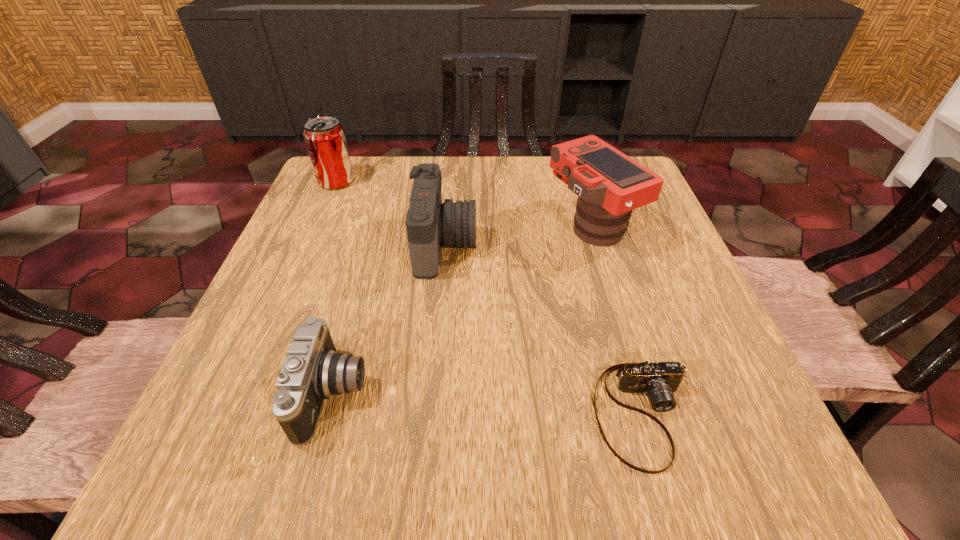
Identify which object is the third closest to the third object from left to right. Please provide its 2D coordinates. Your answer should be formatted as a tuple, i.e. [(x, y)], where the tuple contains the x and y coordinates of a point satisfying the conditions above.

[(325, 138)]

Find the location of a particular element. The height and width of the screenshot is (540, 960). the second closest camera to the third object from right to left is located at coordinates (312, 371).

Choose which camera is the second nearest neighbor to the third object from right to left. Please provide its 2D coordinates. Your answer should be formatted as a tuple, i.e. [(x, y)], where the tuple contains the x and y coordinates of a point satisfying the conditions above.

[(312, 371)]